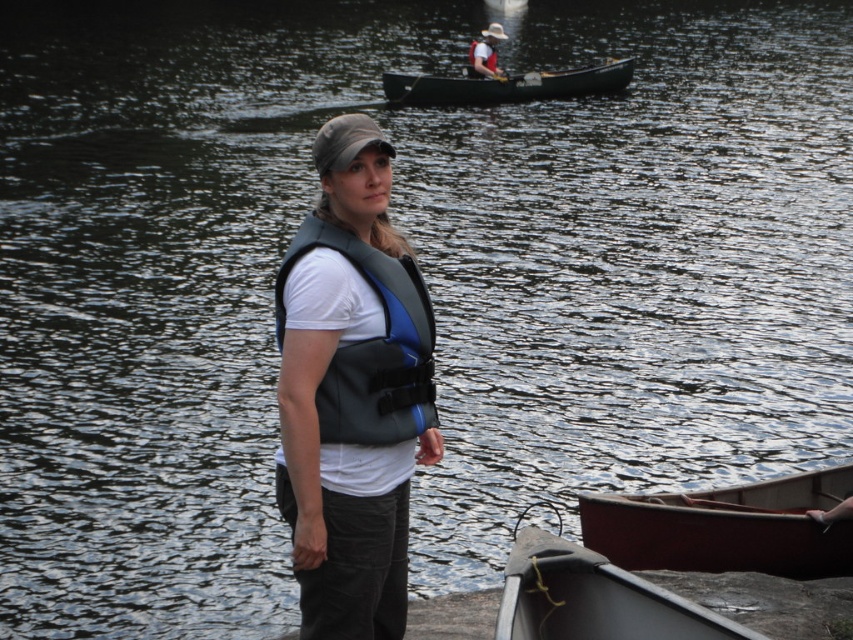
Is black plastic canoe at upper center to the left of white fabric baseball hat at upper center from the viewer's perspective?

Correct, you'll find black plastic canoe at upper center to the left of white fabric baseball hat at upper center.

Between point (593, 80) and point (485, 36), which one is positioned behind?

Positioned behind is point (485, 36).

Between point (444, 80) and point (490, 28), which one is positioned in front?

Positioned in front is point (444, 80).

You are a GUI agent. You are given a task and a screenshot of the screen. Output one action in this format:
    pyautogui.click(x=<x>, y=<y>)
    Task: Click on the black plastic canoe at upper center
    The height and width of the screenshot is (640, 853).
    Given the screenshot: What is the action you would take?
    pyautogui.click(x=505, y=84)

Measure the distance between point (718,563) and camera.

Point (718,563) and camera are 45.58 feet apart.

Who is positioned more to the left, smooth red canoe at lower right or matte blue life vest at upper center?

matte blue life vest at upper center

I want to click on smooth red canoe at lower right, so click(726, 528).

At what (x,y) coordinates should I click in order to perform the action: click on smooth red canoe at lower right. Please return your answer as a coordinate pair (x, y). The image size is (853, 640). Looking at the image, I should click on (726, 528).

Is point (329, 369) farther from viewer compared to point (486, 42)?

No, (329, 369) is closer to viewer.

Can you confirm if gray/blue fabric life jacket at center is smaller than blue fabric life jacket at upper center?

Correct, gray/blue fabric life jacket at center occupies less space than blue fabric life jacket at upper center.

Measure the distance between point (368, 268) and camera.

30.36 feet

Find the location of `gray/blue fabric life jacket at center`. gray/blue fabric life jacket at center is located at coordinates (370, 346).